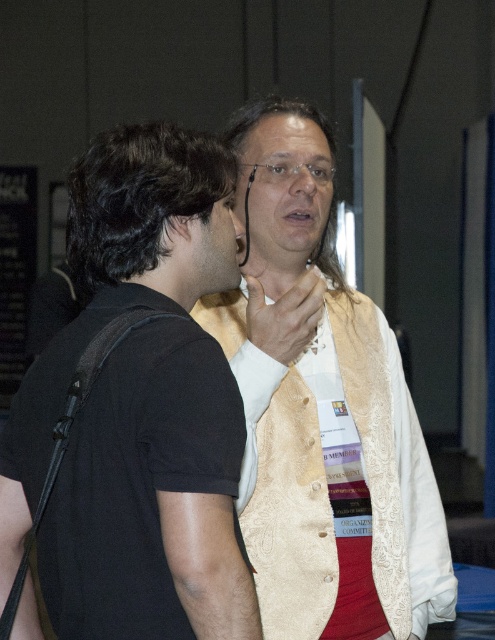
Question: Does black fabric bag at left lie in front of gold brocade vest at center?

Choices:
 (A) yes
 (B) no

Answer: (A)

Question: Can you confirm if black fabric bag at left is positioned above gold brocade vest at center?

Choices:
 (A) no
 (B) yes

Answer: (A)

Question: Can you confirm if black fabric bag at left is wider than gold brocade vest at center?

Choices:
 (A) no
 (B) yes

Answer: (A)

Question: Which of the following is the farthest from the observer?

Choices:
 (A) tap(319, 394)
 (B) tap(72, 589)

Answer: (A)

Question: Which point is farther to the camera?

Choices:
 (A) black fabric bag at left
 (B) gold brocade vest at center

Answer: (B)